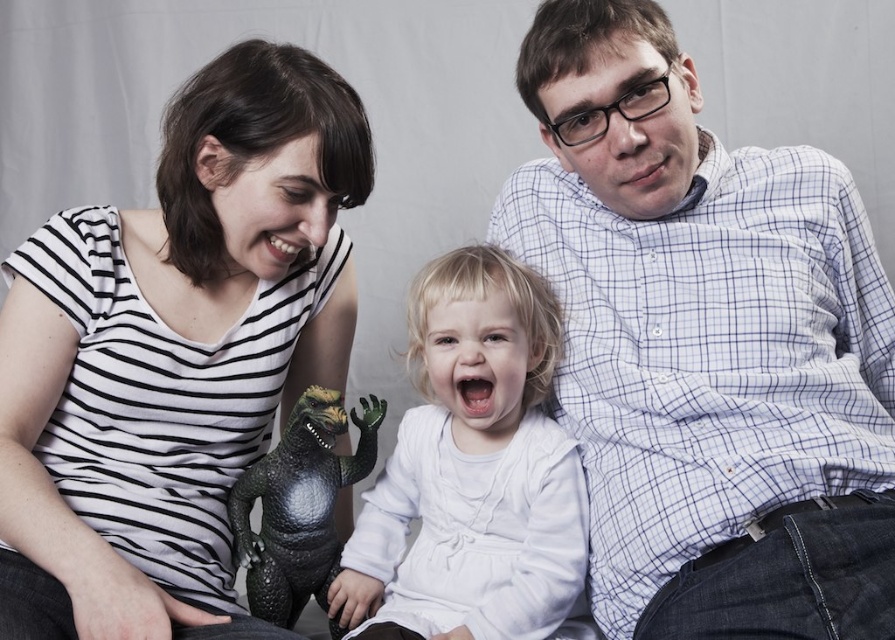
Question: Can you confirm if matte black dinosaur toy at lower left is positioned to the left of white matte/soft fabric baby at center?

Choices:
 (A) yes
 (B) no

Answer: (A)

Question: Can you confirm if matte black dinosaur toy at lower left is positioned to the left of white matte/soft fabric baby at center?

Choices:
 (A) yes
 (B) no

Answer: (A)

Question: Does white checkered shirt at upper right appear under white matte/soft fabric baby at center?

Choices:
 (A) yes
 (B) no

Answer: (B)

Question: Based on their relative distances, which object is farther from the white checkered shirt at upper right?

Choices:
 (A) matte black dinosaur toy at lower left
 (B) white matte/soft fabric baby at center

Answer: (A)

Question: Which of the following is the closest to the observer?

Choices:
 (A) matte black dinosaur toy at lower left
 (B) white checkered shirt at upper right
 (C) white matte/soft fabric baby at center

Answer: (A)

Question: Which of the following is the farthest from the observer?

Choices:
 (A) white checkered shirt at upper right
 (B) matte black dinosaur toy at lower left

Answer: (A)